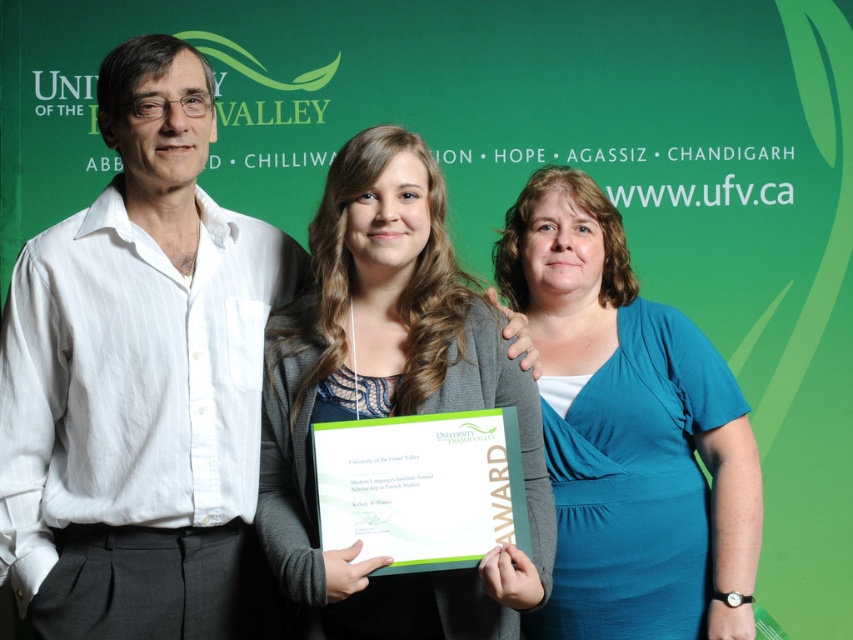
Does blue jersey at center have a smaller size compared to green paper award at center?

Incorrect, blue jersey at center is not smaller in size than green paper award at center.

Is point (706, 424) positioned before point (490, 509)?

No.

What do you see at coordinates (627, 432) in the screenshot? The width and height of the screenshot is (853, 640). I see `blue jersey at center` at bounding box center [627, 432].

At what (x,y) coordinates should I click in order to perform the action: click on blue jersey at center. Please return your answer as a coordinate pair (x, y). Image resolution: width=853 pixels, height=640 pixels. Looking at the image, I should click on (627, 432).

Does blue jersey at center have a larger size compared to matte gray cardigan at center?

A: Correct, blue jersey at center is larger in size than matte gray cardigan at center.

Does blue jersey at center have a lesser height compared to matte gray cardigan at center?

No.

Image resolution: width=853 pixels, height=640 pixels. Describe the element at coordinates (627, 432) in the screenshot. I see `blue jersey at center` at that location.

Image resolution: width=853 pixels, height=640 pixels. I want to click on blue jersey at center, so click(x=627, y=432).

Between white cotton shirt at left and green paper award at center, which one appears on the right side from the viewer's perspective?

green paper award at center

Can you confirm if white cotton shirt at left is bigger than green paper award at center?

Yes, white cotton shirt at left is bigger than green paper award at center.

Which is behind, point (178, 84) or point (445, 532)?

The point (178, 84) is behind.

The width and height of the screenshot is (853, 640). I want to click on white cotton shirt at left, so click(x=141, y=381).